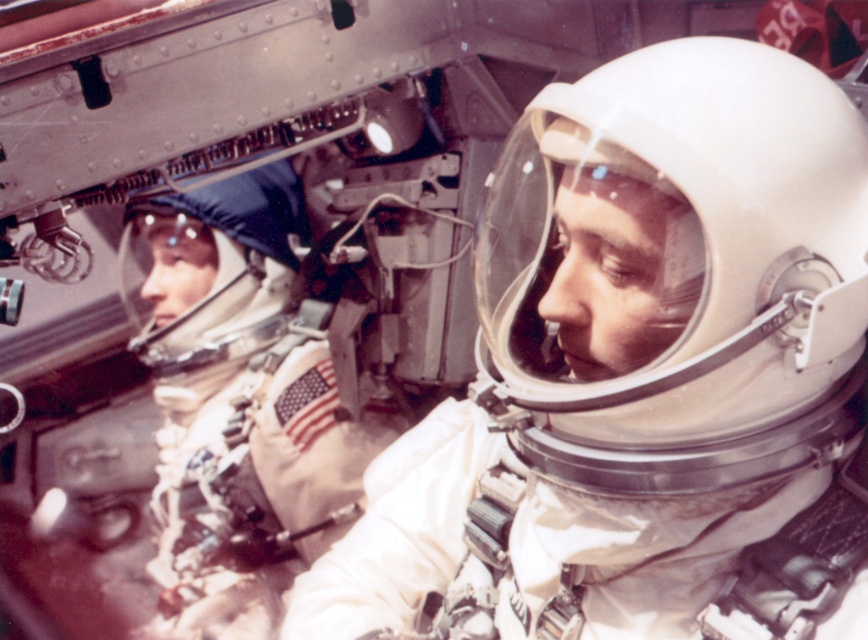
Question: Which object is farther from the camera taking this photo?

Choices:
 (A) white matte spacesuit at center
 (B) white matte helmet at center

Answer: (A)

Question: Is white matte helmet at center below white matte helmet at left?

Choices:
 (A) yes
 (B) no

Answer: (A)

Question: Which of the following is the closest to the observer?

Choices:
 (A) (643, 132)
 (B) (294, 195)
 (C) (140, 340)

Answer: (A)

Question: Which of these objects is positioned closest to the white matte helmet at center?

Choices:
 (A) white matte spacesuit at center
 (B) white matte helmet at left

Answer: (A)

Question: Does white matte helmet at center lie in front of white matte spacesuit at center?

Choices:
 (A) yes
 (B) no

Answer: (A)

Question: Can you confirm if white matte spacesuit at center is positioned below white matte helmet at left?

Choices:
 (A) yes
 (B) no

Answer: (A)